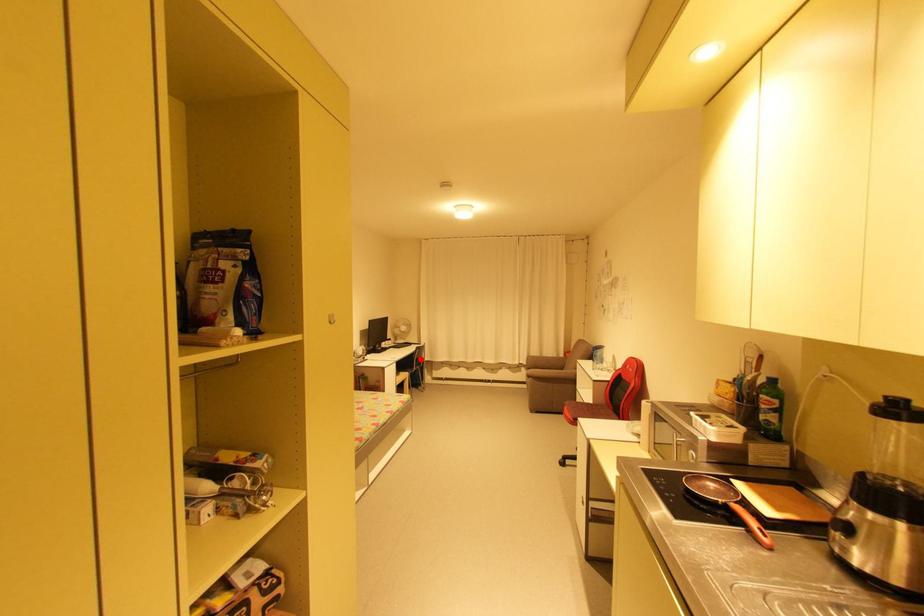
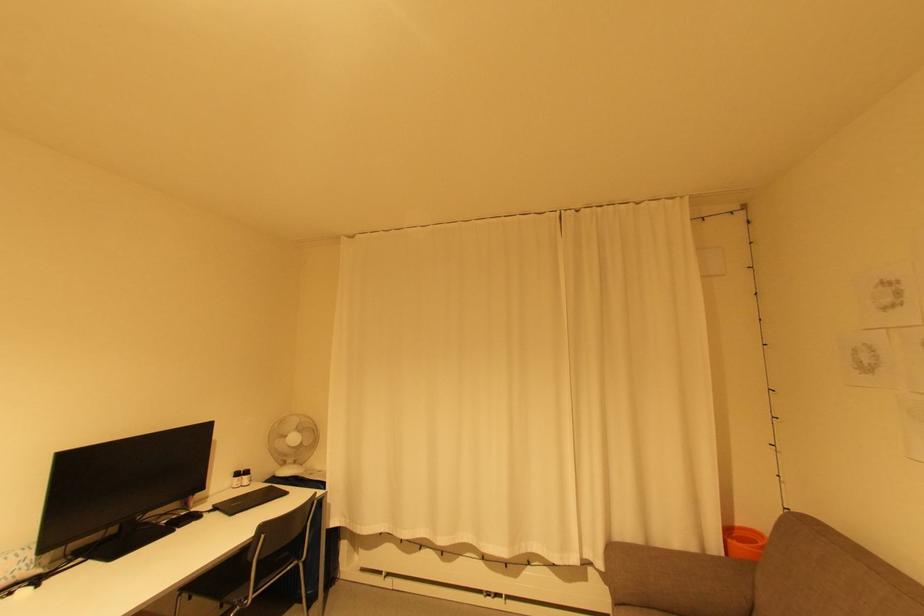
Question: I am providing you with two images of the same scene from different viewpoints. Given a red point in image1, look at the same physical point in image2. Is it:

Choices:
 (A) Closer to the viewpoint
 (B) Farther from the viewpoint

Answer: (A)